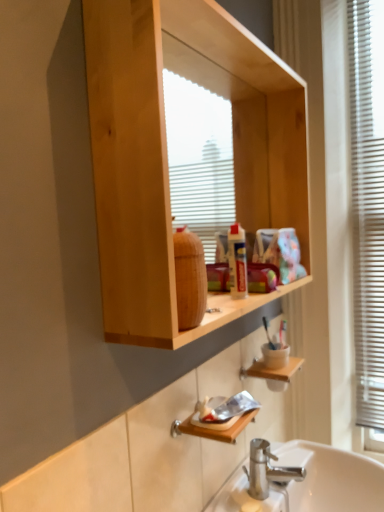
You are a GUI agent. You are given a task and a screenshot of the screen. Output one action in this format:
    pyautogui.click(x=<x>, y=<y>)
    Task: Click on the wooden shelf at lower center
    
    Given the screenshot: What is the action you would take?
    pyautogui.click(x=272, y=370)

This screenshot has width=384, height=512. What do you see at coordinates (368, 205) in the screenshot?
I see `white plastic blinds at right` at bounding box center [368, 205].

Locate an element on the screen. wooden shelf at lower center is located at coordinates (272, 370).

Is white plastic blinds at right to the left or to the right of wooden shelf at lower center in the image?

In the image, white plastic blinds at right appears on the right side of wooden shelf at lower center.

In terms of size, does white plastic blinds at right appear bigger or smaller than wooden shelf at lower center?

white plastic blinds at right is bigger than wooden shelf at lower center.

Is white plastic blinds at right situated inside wooden shelf at lower center or outside?

white plastic blinds at right exists outside the volume of wooden shelf at lower center.

Relative to natural wood cabinet at upper center, is white plastic blinds at right in front or behind?

white plastic blinds at right is behind natural wood cabinet at upper center.

Can you confirm if white plastic blinds at right is positioned to the left of natural wood cabinet at upper center?

Incorrect, white plastic blinds at right is not on the left side of natural wood cabinet at upper center.

Is white plastic blinds at right outside of natural wood cabinet at upper center?

Yes.

From a real-world perspective, is white plastic blinds at right located higher than natural wood cabinet at upper center?

No.

Considering the sizes of objects wooden shelf at lower center and white plastic blinds at right in the image provided, who is thinner, wooden shelf at lower center or white plastic blinds at right?

With smaller width is white plastic blinds at right.

Considering the positions of objects wooden shelf at lower center and white plastic blinds at right in the image provided, who is more to the left, wooden shelf at lower center or white plastic blinds at right?

wooden shelf at lower center is more to the left.

Locate an element on the screen. The image size is (384, 512). window frame above the wooden shelf at lower center (from the image's perspective) is located at coordinates point(368,205).

Is wooden shelf at lower center positioned far away from white plastic blinds at right?

wooden shelf at lower center is near white plastic blinds at right, not far away.

Measure the distance from natural wood cabinet at upper center to white plastic blinds at right.

natural wood cabinet at upper center and white plastic blinds at right are 23.21 inches apart from each other.

Considering their positions, is natural wood cabinet at upper center located in front of or behind white plastic blinds at right?

In the image, natural wood cabinet at upper center appears in front of white plastic blinds at right.

Is natural wood cabinet at upper center taller or shorter than white plastic blinds at right?

Considering their sizes, natural wood cabinet at upper center has less height than white plastic blinds at right.

You are a GUI agent. You are given a task and a screenshot of the screen. Output one action in this format:
    pyautogui.click(x=<x>, y=<y>)
    Task: Click on the window frame below the natural wood cabinet at upper center (from the image's perspective)
    
    Given the screenshot: What is the action you would take?
    pyautogui.click(x=368, y=205)

Who is smaller, natural wood cabinet at upper center or wooden shelf at lower center?

With smaller size is wooden shelf at lower center.

Can you tell me how much natural wood cabinet at upper center and wooden shelf at lower center differ in facing direction?

The angular difference between natural wood cabinet at upper center and wooden shelf at lower center is 2.85 degrees.

Does natural wood cabinet at upper center have a greater width compared to wooden shelf at lower center?

Incorrect, the width of natural wood cabinet at upper center does not surpass that of wooden shelf at lower center.

Is natural wood cabinet at upper center positioned with its back to wooden shelf at lower center?

No, wooden shelf at lower center is not at the back of natural wood cabinet at upper center.

Could you tell me if wooden shelf at lower center is turned towards natural wood cabinet at upper center?

No, wooden shelf at lower center is not aimed at natural wood cabinet at upper center.

From a real-world perspective, is wooden shelf at lower center positioned over natural wood cabinet at upper center based on gravity?

No, from a real-world perspective, wooden shelf at lower center is not on top of natural wood cabinet at upper center.

Looking at this image, does wooden shelf at lower center come behind natural wood cabinet at upper center?

Yes, it is behind natural wood cabinet at upper center.

Image resolution: width=384 pixels, height=512 pixels. In order to click on cabinet below the white plastic blinds at right (from a real-world perspective) in this screenshot , I will do [x=272, y=370].

This screenshot has height=512, width=384. What are the coordinates of `window frame that appears on the right of natural wood cabinet at upper center` in the screenshot? It's located at (368, 205).

Considering their positions, is white plastic blinds at right positioned closer to natural wood cabinet at upper center than wooden shelf at lower center?

Based on the image, white plastic blinds at right appears to be nearer to natural wood cabinet at upper center.

Based on their spatial positions, is wooden shelf at lower center or white plastic blinds at right further from natural wood cabinet at upper center?

wooden shelf at lower center is positioned further to the anchor natural wood cabinet at upper center.

Which object lies nearer to the anchor point wooden shelf at lower center, natural wood cabinet at upper center or white plastic blinds at right?

Among the two, natural wood cabinet at upper center is located nearer to wooden shelf at lower center.

When comparing their distances from white plastic blinds at right, does natural wood cabinet at upper center or wooden shelf at lower center seem further?

The object further to white plastic blinds at right is wooden shelf at lower center.

Looking at the image, which one is located closer to wooden shelf at lower center, white plastic blinds at right or natural wood cabinet at upper center?

natural wood cabinet at upper center lies closer to wooden shelf at lower center than the other object.

Which object lies further to the anchor point white plastic blinds at right, wooden shelf at lower center or natural wood cabinet at upper center?

Based on the image, wooden shelf at lower center appears to be further to white plastic blinds at right.

Locate an element on the screen. Image resolution: width=384 pixels, height=512 pixels. cabinet positioned between natural wood cabinet at upper center and white plastic blinds at right from near to far is located at coordinates (272, 370).